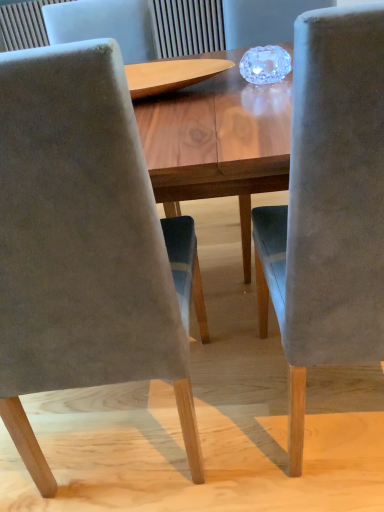
This screenshot has height=512, width=384. Identify the location of velvet gray chair at right, which ranks as the first chair in right-to-left order. (328, 207).

The width and height of the screenshot is (384, 512). Describe the element at coordinates (328, 207) in the screenshot. I see `velvet gray chair at right, the second chair in the left-to-right sequence` at that location.

The image size is (384, 512). What do you see at coordinates (84, 244) in the screenshot? I see `velvet gray chair at center, the 1th chair positioned from the left` at bounding box center [84, 244].

The height and width of the screenshot is (512, 384). What are the coordinates of `velvet gray chair at center, which ranks as the second chair in right-to-left order` in the screenshot? It's located at (84, 244).

At what (x,y) coordinates should I click in order to perform the action: click on velvet gray chair at right, the second chair in the left-to-right sequence. Please return your answer as a coordinate pair (x, y). Looking at the image, I should click on (328, 207).

Which object is positioned more to the left, velvet gray chair at right, which ranks as the first chair in right-to-left order, or velvet gray chair at center, which ranks as the second chair in right-to-left order?

Positioned to the left is velvet gray chair at center, which ranks as the second chair in right-to-left order.

Is velvet gray chair at right, the second chair in the left-to-right sequence, positioned before velvet gray chair at center, which ranks as the second chair in right-to-left order?

Yes, the depth of velvet gray chair at right, the second chair in the left-to-right sequence, is less than that of velvet gray chair at center, which ranks as the second chair in right-to-left order.

Is point (346, 297) closer or farther from the camera than point (86, 100)?

Point (346, 297) appears to be farther away from the viewer than point (86, 100).

From the image's perspective, is velvet gray chair at right, the second chair in the left-to-right sequence, located above velvet gray chair at center, which ranks as the second chair in right-to-left order?

Indeed, from the image's perspective, velvet gray chair at right, the second chair in the left-to-right sequence, is shown above velvet gray chair at center, which ranks as the second chair in right-to-left order.

From a real-world perspective, which object stands above the other?

velvet gray chair at center, the 1th chair positioned from the left.

In terms of width, does velvet gray chair at right, which ranks as the first chair in right-to-left order, look wider or thinner when compared to velvet gray chair at center, which ranks as the second chair in right-to-left order?

Considering their sizes, velvet gray chair at right, which ranks as the first chair in right-to-left order, looks slimmer than velvet gray chair at center, which ranks as the second chair in right-to-left order.

Which of these two, velvet gray chair at right, the second chair in the left-to-right sequence, or velvet gray chair at center, which ranks as the second chair in right-to-left order, stands shorter?

velvet gray chair at right, the second chair in the left-to-right sequence.

Considering the relative sizes of velvet gray chair at right, the second chair in the left-to-right sequence, and velvet gray chair at center, the 1th chair positioned from the left, in the image provided, is velvet gray chair at right, the second chair in the left-to-right sequence, smaller than velvet gray chair at center, the 1th chair positioned from the left,?

Yes.

Does velvet gray chair at right, the second chair in the left-to-right sequence, contain velvet gray chair at center, the 1th chair positioned from the left?

No, velvet gray chair at center, the 1th chair positioned from the left, is not inside velvet gray chair at right, the second chair in the left-to-right sequence.

Can you see velvet gray chair at right, the second chair in the left-to-right sequence, touching velvet gray chair at center, which ranks as the second chair in right-to-left order?

No, velvet gray chair at right, the second chair in the left-to-right sequence, is not making contact with velvet gray chair at center, which ranks as the second chair in right-to-left order.

Is velvet gray chair at right, which ranks as the first chair in right-to-left order, looking in the opposite direction of velvet gray chair at center, which ranks as the second chair in right-to-left order?

No.

At what (x,y) coordinates should I click in order to perform the action: click on chair that appears behind the velvet gray chair at right, which ranks as the first chair in right-to-left order. Please return your answer as a coordinate pair (x, y). Image resolution: width=384 pixels, height=512 pixels. Looking at the image, I should click on (84, 244).

Considering the relative positions of velvet gray chair at center, which ranks as the second chair in right-to-left order, and velvet gray chair at right, which ranks as the first chair in right-to-left order, in the image provided, is velvet gray chair at center, which ranks as the second chair in right-to-left order, to the right of velvet gray chair at right, which ranks as the first chair in right-to-left order, from the viewer's perspective?

No, velvet gray chair at center, which ranks as the second chair in right-to-left order, is not to the right of velvet gray chair at right, which ranks as the first chair in right-to-left order.

Relative to velvet gray chair at right, which ranks as the first chair in right-to-left order, is velvet gray chair at center, which ranks as the second chair in right-to-left order, in front or behind?

velvet gray chair at center, which ranks as the second chair in right-to-left order, is positioned farther from the viewer than velvet gray chair at right, which ranks as the first chair in right-to-left order.

Is point (68, 276) positioned before point (295, 212)?

No.

From the image's perspective, between velvet gray chair at center, the 1th chair positioned from the left, and velvet gray chair at right, which ranks as the first chair in right-to-left order, who is located below?

velvet gray chair at center, the 1th chair positioned from the left.

From a real-world perspective, is velvet gray chair at center, the 1th chair positioned from the left, above or below velvet gray chair at right, the second chair in the left-to-right sequence?

velvet gray chair at center, the 1th chair positioned from the left, is above velvet gray chair at right, the second chair in the left-to-right sequence.

Considering the relative sizes of velvet gray chair at center, which ranks as the second chair in right-to-left order, and velvet gray chair at right, the second chair in the left-to-right sequence, in the image provided, is velvet gray chair at center, which ranks as the second chair in right-to-left order, thinner than velvet gray chair at right, the second chair in the left-to-right sequence,?

In fact, velvet gray chair at center, which ranks as the second chair in right-to-left order, might be wider than velvet gray chair at right, the second chair in the left-to-right sequence.

Can you confirm if velvet gray chair at center, the 1th chair positioned from the left, is taller than velvet gray chair at right, which ranks as the first chair in right-to-left order?

Correct, velvet gray chair at center, the 1th chair positioned from the left, is much taller as velvet gray chair at right, which ranks as the first chair in right-to-left order.

Can you confirm if velvet gray chair at center, which ranks as the second chair in right-to-left order, is bigger than velvet gray chair at right, which ranks as the first chair in right-to-left order?

Yes, velvet gray chair at center, which ranks as the second chair in right-to-left order, is bigger than velvet gray chair at right, which ranks as the first chair in right-to-left order.

Is velvet gray chair at right, which ranks as the first chair in right-to-left order, a part of velvet gray chair at center, the 1th chair positioned from the left?

No, velvet gray chair at right, which ranks as the first chair in right-to-left order, is located outside of velvet gray chair at center, the 1th chair positioned from the left.

Is velvet gray chair at center, which ranks as the second chair in right-to-left order, next to velvet gray chair at right, the second chair in the left-to-right sequence, and touching it?

velvet gray chair at center, which ranks as the second chair in right-to-left order, and velvet gray chair at right, the second chair in the left-to-right sequence, are clearly separated.

In the scene shown: Is velvet gray chair at center, the 1th chair positioned from the left, facing away from velvet gray chair at right, which ranks as the first chair in right-to-left order?

No, velvet gray chair at right, which ranks as the first chair in right-to-left order, is not at the back of velvet gray chair at center, the 1th chair positioned from the left.

This screenshot has width=384, height=512. In order to click on chair above the velvet gray chair at center, the 1th chair positioned from the left (from the image's perspective) in this screenshot , I will do `click(328, 207)`.

In the image, there is a velvet gray chair at center, the 1th chair positioned from the left. Where is `chair below it (from a real-world perspective)`? chair below it (from a real-world perspective) is located at coordinates (328, 207).

The height and width of the screenshot is (512, 384). I want to click on chair that is on the left side of velvet gray chair at right, which ranks as the first chair in right-to-left order, so click(84, 244).